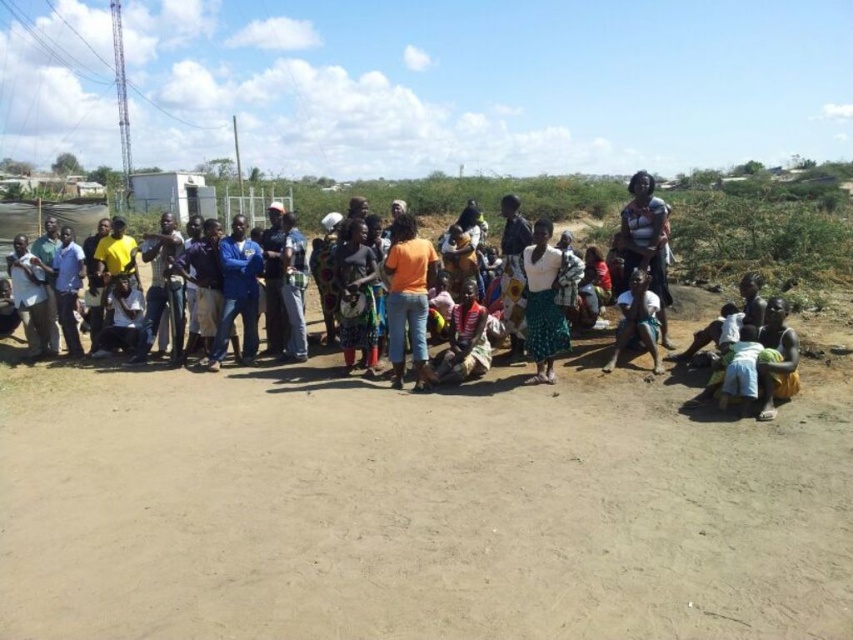
Question: Which is farther from the brown sandy ground at center?

Choices:
 (A) orange cotton shirt at center
 (B) orange matte shirt at center
 (C) white fabric skirt at center

Answer: (A)

Question: Does brown sandy ground at center have a larger size compared to orange cotton shirt at center?

Choices:
 (A) yes
 (B) no

Answer: (B)

Question: Does brown sandy ground at center have a greater width compared to orange matte shirt at center?

Choices:
 (A) yes
 (B) no

Answer: (A)

Question: Does white fabric skirt at center appear under light brown fabric skirt at lower right?

Choices:
 (A) no
 (B) yes

Answer: (A)

Question: Which of these objects is positioned closest to the white fabric skirt at center?

Choices:
 (A) orange cotton shirt at center
 (B) light brown fabric skirt at lower right

Answer: (B)

Question: Which of the following is the farthest from the observer?

Choices:
 (A) (711, 205)
 (B) (393, 284)
 (C) (164, 477)

Answer: (A)